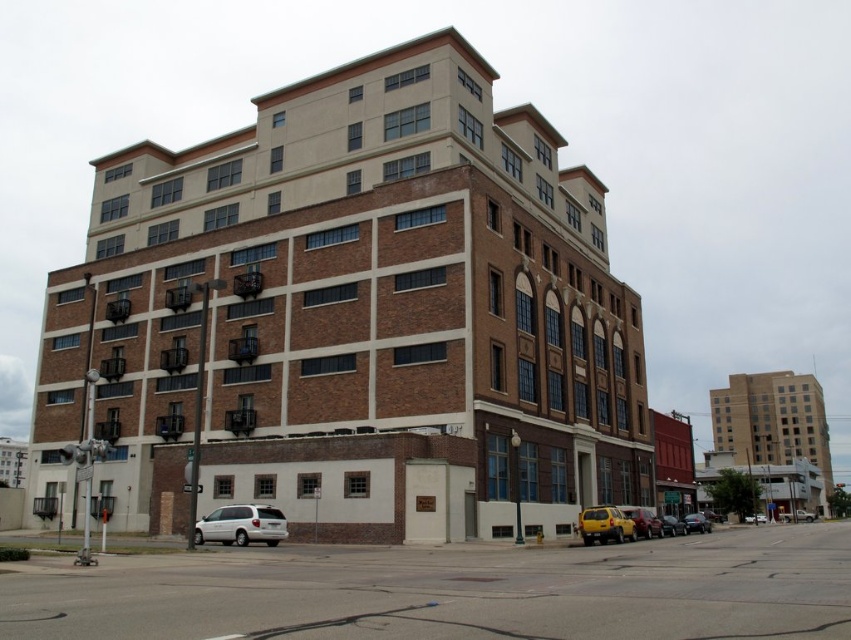
Question: In this image, where is yellow matte car at lower right located relative to shiny black sedan at center?

Choices:
 (A) left
 (B) right

Answer: (A)

Question: From the image, what is the correct spatial relationship of yellow matte car at lower right in relation to matte black sedan at lower right?

Choices:
 (A) left
 (B) right

Answer: (A)

Question: Is white matte van at lower left positioned behind shiny black sedan at center?

Choices:
 (A) no
 (B) yes

Answer: (A)

Question: Which point appears closest to the camera in this image?

Choices:
 (A) (266, 524)
 (B) (598, 632)

Answer: (B)

Question: Which object is closer to the camera taking this photo?

Choices:
 (A) matte black sedan at lower right
 (B) metallic yellow van at lower right
 (C) white matte van at lower left
 (D) shiny black sedan at center

Answer: (C)

Question: Which point is farther to the camera?

Choices:
 (A) yellow matte car at lower right
 (B) metallic yellow van at lower right
 (C) matte black sedan at lower right
 (D) shiny black sedan at center

Answer: (D)